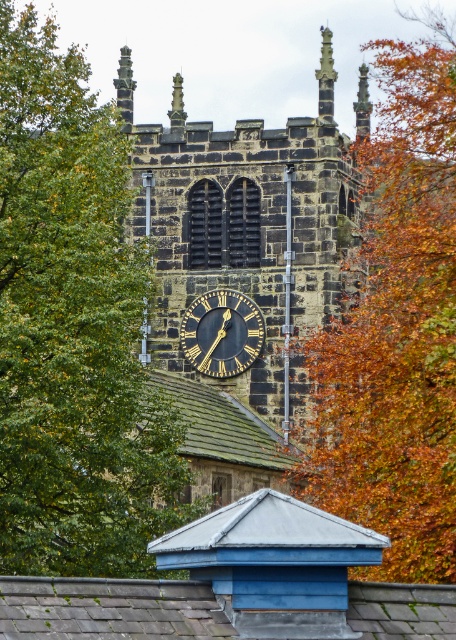
Is green leafy tree at upper left positioned before black polished stone clock at center?

Yes, it is.

Image resolution: width=456 pixels, height=640 pixels. In order to click on green leafy tree at upper left in this screenshot , I will do `click(72, 328)`.

Can you confirm if green leafy tree at upper left is bigger than orange leafy tree at right?

Correct, green leafy tree at upper left is larger in size than orange leafy tree at right.

Does point (46, 380) come in front of point (395, 173)?

Yes, point (46, 380) is closer to viewer.

At what (x,y) coordinates should I click in order to perform the action: click on green leafy tree at upper left. Please return your answer as a coordinate pair (x, y). This screenshot has height=640, width=456. Looking at the image, I should click on (72, 328).

Does orange leafy tree at right appear on the right side of polished stone spire at upper center?

Indeed, orange leafy tree at right is positioned on the right side of polished stone spire at upper center.

What do you see at coordinates (397, 326) in the screenshot?
I see `orange leafy tree at right` at bounding box center [397, 326].

Which is in front, point (428, 451) or point (324, 116)?

Positioned in front is point (428, 451).

At what (x,y) coordinates should I click in order to perform the action: click on orange leafy tree at right. Please return your answer as a coordinate pair (x, y). This screenshot has width=456, height=640. Looking at the image, I should click on (397, 326).